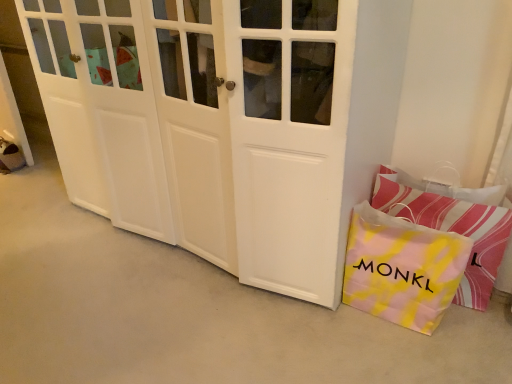
Question: Is point (425, 198) closer or farther from the camera than point (207, 117)?

Choices:
 (A) closer
 (B) farther

Answer: (B)

Question: Considering their positions, is pink striped pillow at lower right located in front of or behind white matte door at center?

Choices:
 (A) behind
 (B) front

Answer: (A)

Question: Considering the real-world distances, which object is closest to the pink striped pillow at lower right?

Choices:
 (A) yellow tie-dye paper bag at lower right
 (B) white matte door at center

Answer: (A)

Question: Estimate the real-world distances between objects in this image. Which object is farther from the white matte door at center?

Choices:
 (A) yellow tie-dye paper bag at lower right
 (B) pink striped pillow at lower right

Answer: (B)